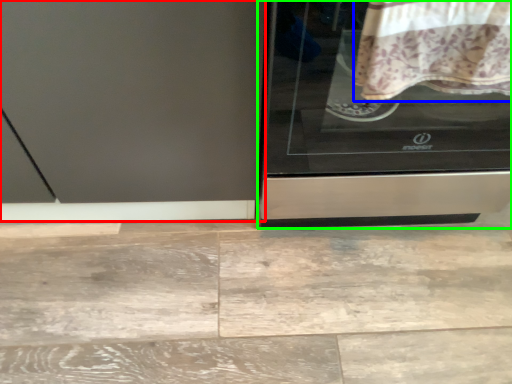
Question: Based on their relative distances, which object is nearer to screen door (highlighted by a red box)? Choose from blanket (highlighted by a blue box) and home appliance (highlighted by a green box).

Choices:
 (A) blanket
 (B) home appliance

Answer: (B)